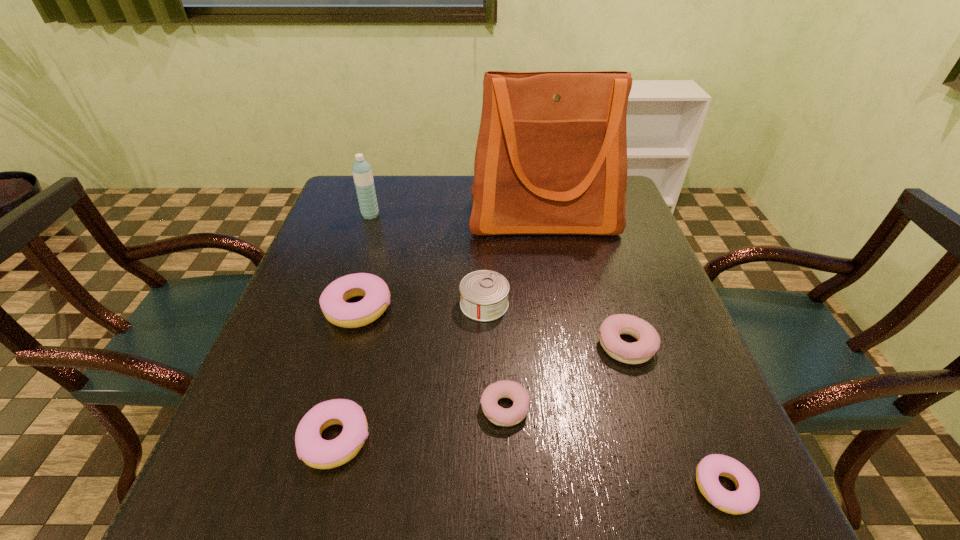
The height and width of the screenshot is (540, 960). Identify the location of blank area at the right edge. (660, 277).

Where is `free space at the far left corner of the desktop`? Image resolution: width=960 pixels, height=540 pixels. free space at the far left corner of the desktop is located at coordinates (383, 175).

This screenshot has height=540, width=960. I want to click on vacant space at the near left corner of the desktop, so click(x=228, y=522).

Where is `free space at the near right corner of the desktop`? The width and height of the screenshot is (960, 540). free space at the near right corner of the desktop is located at coordinates (679, 502).

Locate an element on the screen. The image size is (960, 540). free spot between the second biggest pink doughnut and the smallest pink doughnut is located at coordinates 529,464.

Locate an element on the screen. Image resolution: width=960 pixels, height=540 pixels. vacant area that lies between the blue water bottle and the nearer purple doughnut is located at coordinates (437, 312).

Locate an element on the screen. The image size is (960, 540). vacant point located between the farther purple doughnut and the smallest pink doughnut is located at coordinates (675, 416).

You are a GUI agent. You are given a task and a screenshot of the screen. Output one action in this format:
    pyautogui.click(x=<x>, y=<y>)
    Task: Click on the empty space between the third doughnut from right to left and the silver can
    Image resolution: width=960 pixels, height=540 pixels.
    Given the screenshot: What is the action you would take?
    pyautogui.click(x=494, y=356)

What are the coordinates of `vacant area between the second smallest pink doughnut and the rightmost pink doughnut` in the screenshot? It's located at (529, 464).

I want to click on vacant area that lies between the rightmost pink doughnut and the farther purple doughnut, so click(675, 416).